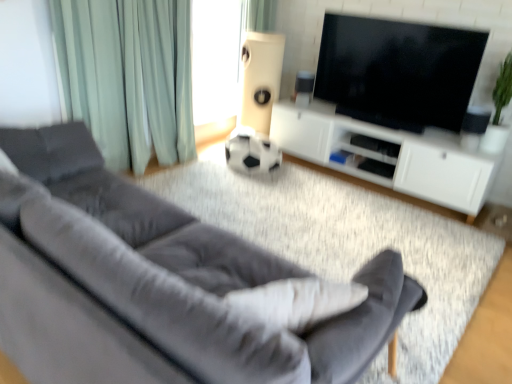
Question: Considering the relative sizes of white matte cabinet at center and black glossy tv at upper center in the image provided, is white matte cabinet at center smaller than black glossy tv at upper center?

Choices:
 (A) no
 (B) yes

Answer: (A)

Question: Is white matte cabinet at center oriented away from black glossy tv at upper center?

Choices:
 (A) no
 (B) yes

Answer: (A)

Question: Can you confirm if white matte cabinet at center is thinner than black glossy tv at upper center?

Choices:
 (A) no
 (B) yes

Answer: (A)

Question: Is white matte cabinet at center not within black glossy tv at upper center?

Choices:
 (A) no
 (B) yes

Answer: (B)

Question: Is the depth of white matte cabinet at center greater than that of black glossy tv at upper center?

Choices:
 (A) yes
 (B) no

Answer: (A)

Question: Are white matte cabinet at center and black glossy tv at upper center located far from each other?

Choices:
 (A) yes
 (B) no

Answer: (B)

Question: Is white matte speaker at center, marked as the second speaker in a right-to-left arrangement, at the right side of velvet gray couch at lower left?

Choices:
 (A) yes
 (B) no

Answer: (A)

Question: Is white matte speaker at center, marked as the second speaker in a right-to-left arrangement, bigger than velvet gray couch at lower left?

Choices:
 (A) yes
 (B) no

Answer: (B)

Question: Can you confirm if white matte speaker at center, which is counted as the first speaker, starting from the left, is shorter than velvet gray couch at lower left?

Choices:
 (A) no
 (B) yes

Answer: (A)

Question: Is white matte speaker at center, marked as the second speaker in a right-to-left arrangement, at the left side of velvet gray couch at lower left?

Choices:
 (A) yes
 (B) no

Answer: (B)

Question: From a real-world perspective, is white matte speaker at center, which is counted as the first speaker, starting from the left, on velvet gray couch at lower left?

Choices:
 (A) no
 (B) yes

Answer: (B)

Question: Is white matte speaker at center, marked as the second speaker in a right-to-left arrangement, located outside velvet gray couch at lower left?

Choices:
 (A) no
 (B) yes

Answer: (B)

Question: Is white matte speaker at center, marked as the second speaker in a right-to-left arrangement, placed right next to black glossy tv at upper center?

Choices:
 (A) yes
 (B) no

Answer: (B)